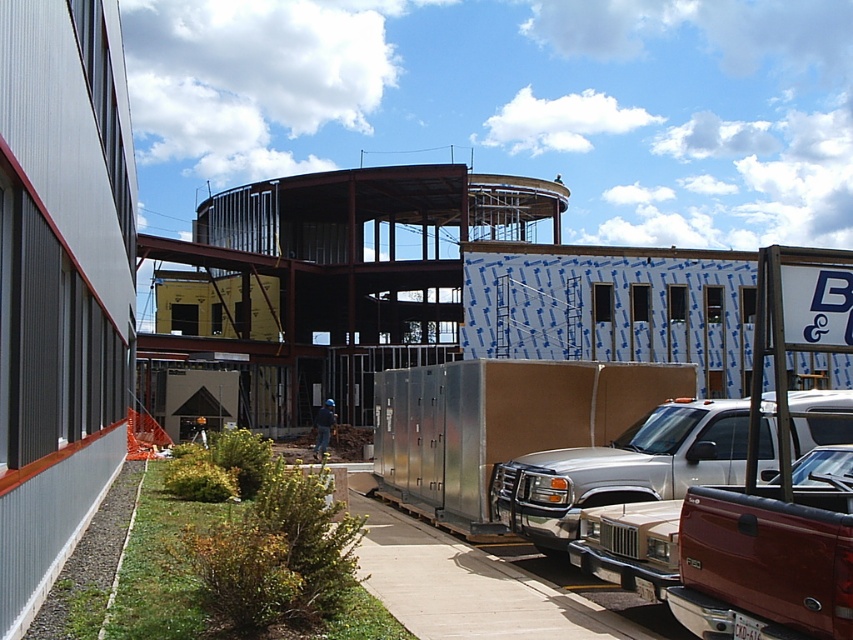
You are standing at the point with coordinates point (833, 435) on a construction site. If you want to take a photo of the entire construction site, would you need to move closer or farther away from your current position?

The point (833, 435) is 10.03 meters away from the camera. To capture the entire construction site in one photo, you would likely need to move farther away from your current position to ensure the entire scene fits within the camera frame.

You are a delivery person arriving at the construction site. You need to park your vehicle, which is the same size as the metallic silver truck at lower right, near the silver metallic trailer at center. Is there enough vertical space between them for your vehicle to pass underneath?

The silver metallic trailer at center is above the metallic silver truck at lower right, so there may not be enough vertical space for your vehicle to pass underneath safely. You should choose a different route or parking spot.

In the scene shown: You are a delivery driver with a 3.5 meter wide truck. You need to maneuver your truck through the space between the silver metallic trailer at center and the silver metallic truck at center. Is there enough space for your truck to pass through?

The distance between the silver metallic trailer at center and the silver metallic truck at center is 7.59 meters. Since your truck is 3.5 meters wide, there is sufficient space for it to pass through the 7.59 meter gap.